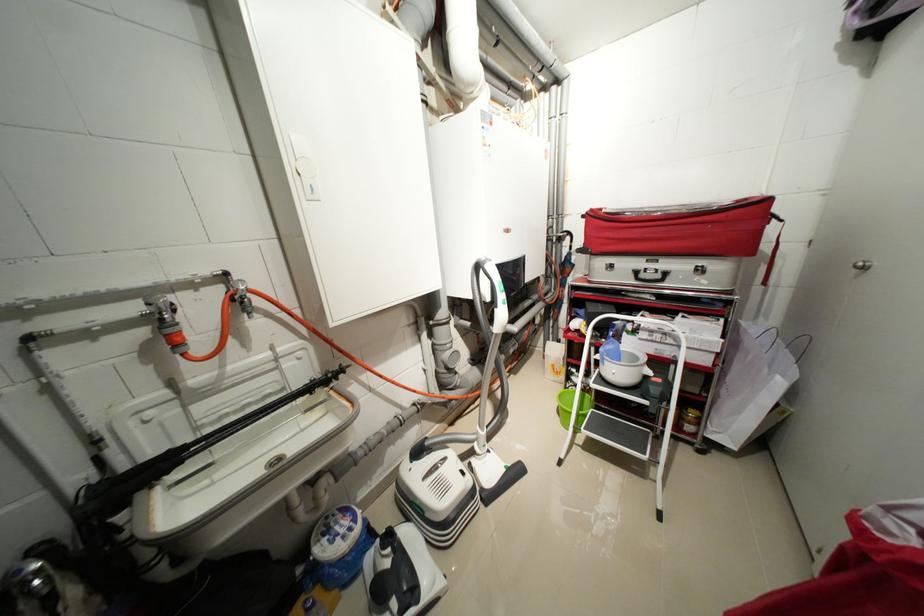
Where would you pull the red bag handle? Please return your answer as a coordinate pair (x, y).

(775, 251)